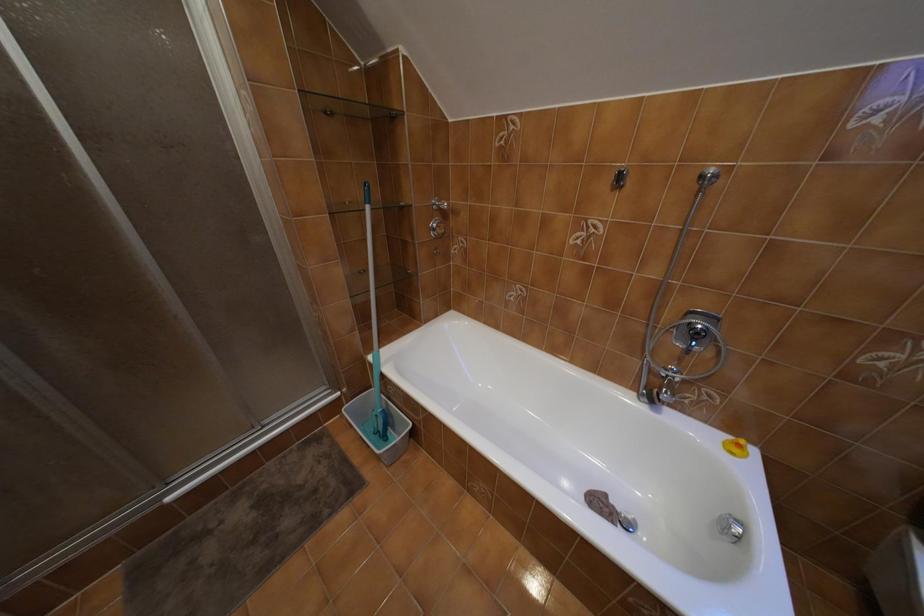
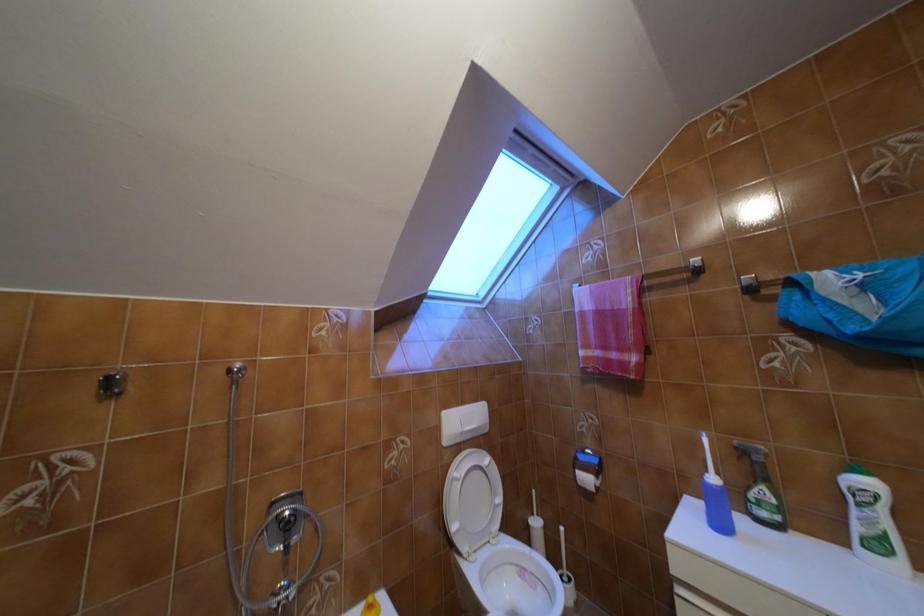
Question: The camera is either moving clockwise (left) or counter-clockwise (right) around the object. The first image is from the beginning of the video and the second image is from the end. Is the camera moving left or right when shooting the video?

Choices:
 (A) Left
 (B) Right

Answer: (A)